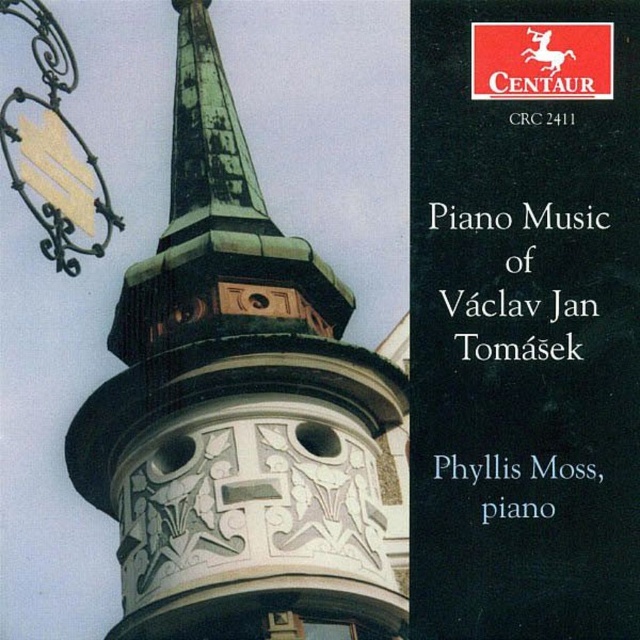
Is green patina spire at upper center smaller than black paper at upper right?

No, green patina spire at upper center is not smaller than black paper at upper right.

Is point (209, 52) farther from viewer compared to point (534, 513)?

Yes, it is behind point (534, 513).

Between point (236, 173) and point (579, 477), which one is positioned in front?

Point (579, 477) is more forward.

Locate an element on the screen. This screenshot has height=640, width=640. green patina spire at upper center is located at coordinates (208, 138).

Measure the distance between green patina tower at center and camera.

green patina tower at center is 232.76 feet from camera.

Can you confirm if green patina tower at center is shorter than metallic red horse at upper right?

No, green patina tower at center is not shorter than metallic red horse at upper right.

Does point (371, 468) come behind point (520, 99)?

Yes, point (371, 468) is farther from viewer.

This screenshot has width=640, height=640. I want to click on green patina tower at center, so click(237, 408).

Is point (216, 120) positioned after point (490, 93)?

Yes.

Where is `green patina spire at upper center`? Image resolution: width=640 pixels, height=640 pixels. green patina spire at upper center is located at coordinates (208, 138).